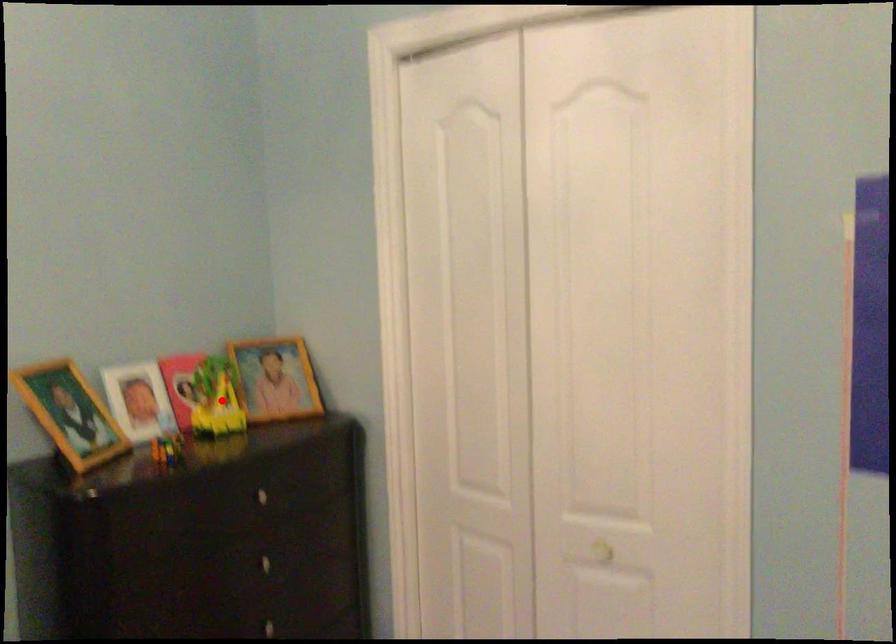
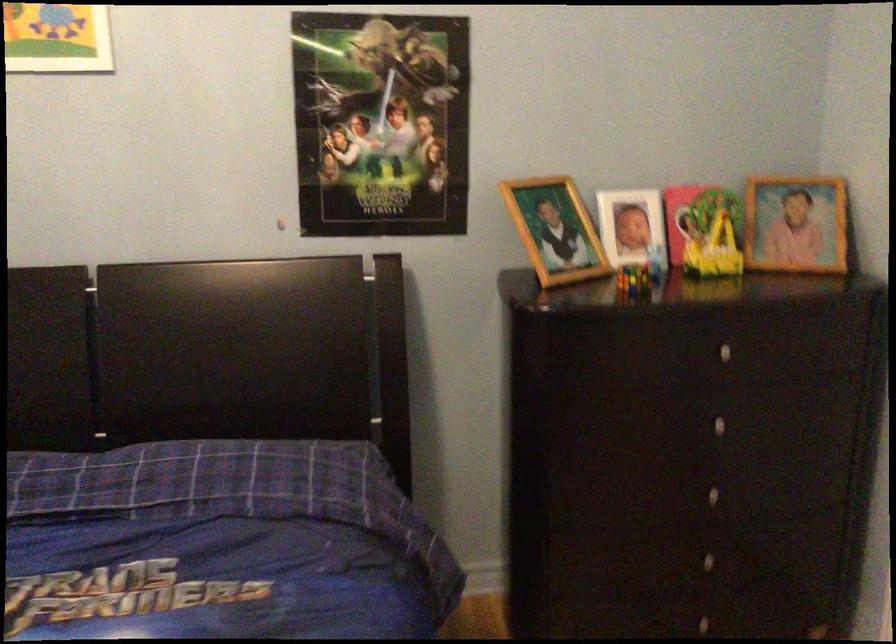
Question: A red point is marked in image1. In image2, is the corresponding 3D point closer to the camera or farther? Reply with the corresponding letter.

Choices:
 (A) The corresponding 3D point is closer.
 (B) The corresponding 3D point is farther.

Answer: (A)